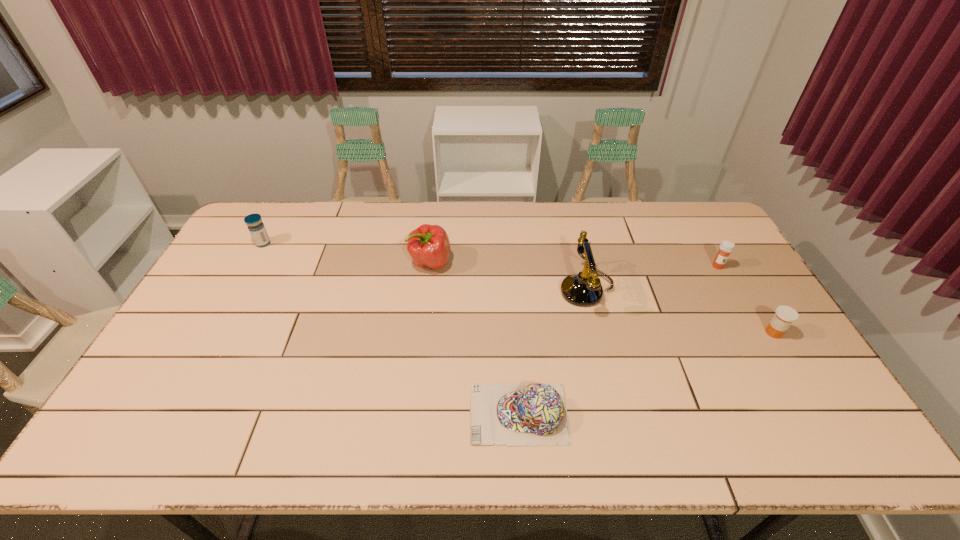
You are a GUI agent. You are given a task and a screenshot of the screen. Output one action in this format:
    pyautogui.click(x=<x>, y=<y>)
    Task: Click on the blank space located on the label of the nearest medicine
    
    Given the screenshot: What is the action you would take?
    pyautogui.click(x=656, y=333)

This screenshot has width=960, height=540. I want to click on vacant space situated on the front, side, and top of the fourth object from right to left, so click(413, 414).

Find the location of a particular element. The width and height of the screenshot is (960, 540). vacant region located 0.170m on the front, side, and top of the fourth object from right to left is located at coordinates (400, 414).

Identify the location of vacant space situated 0.070m on the front, side, and top of the fourth object from right to left. This screenshot has width=960, height=540. (442, 414).

Image resolution: width=960 pixels, height=540 pixels. I want to click on object that is at the far edge, so click(x=256, y=227).

Find the location of a particular element. The image size is (960, 540). object positioned at the near edge is located at coordinates (508, 414).

At what (x,y) coordinates should I click in order to perform the action: click on object located at the left edge. Please return your answer as a coordinate pair (x, y). The image size is (960, 540). Looking at the image, I should click on (256, 227).

I want to click on object present at the far left corner, so click(256, 227).

The height and width of the screenshot is (540, 960). Identify the location of free space at the far edge of the desktop. (456, 227).

Image resolution: width=960 pixels, height=540 pixels. What are the coordinates of `blank space at the left edge of the desktop` in the screenshot? It's located at (219, 338).